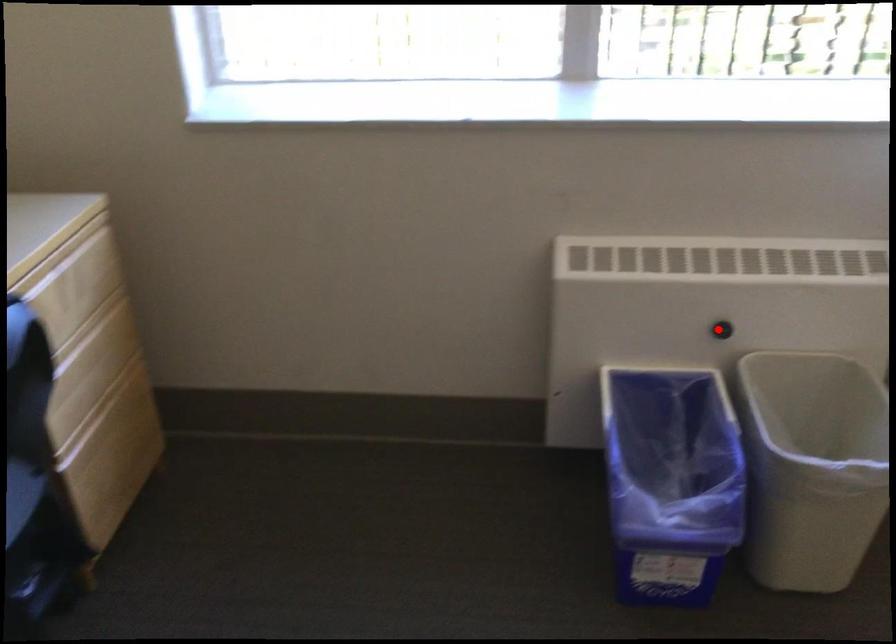
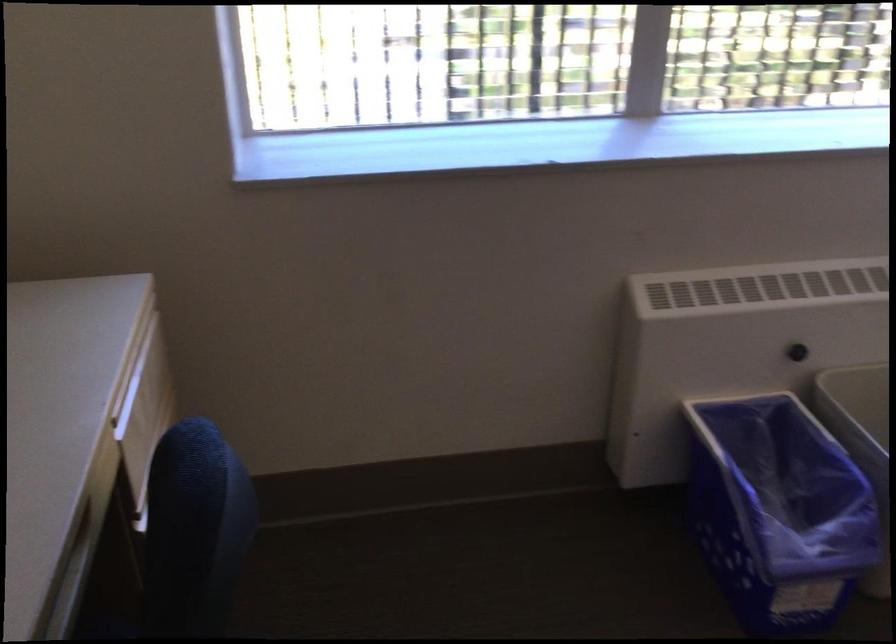
Where in the second image is the point corresponding to the highlighted location from the first image?

(796, 352)